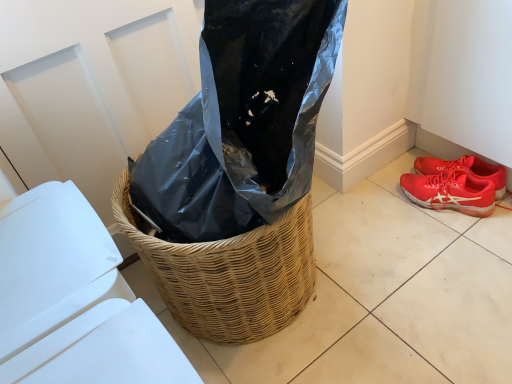
The image size is (512, 384). Identify the location of vacant area that lies in front of shiny red sneakers at lower right, which is the first footwear in bottom-to-top order. (461, 254).